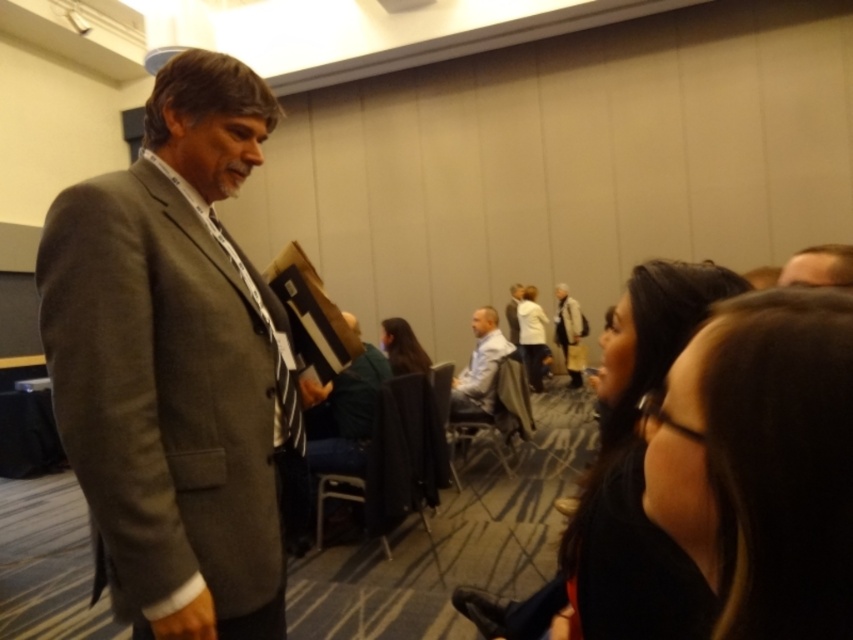
Question: Is gray wool suit at center positioned at the back of black fabric chair at center?

Choices:
 (A) yes
 (B) no

Answer: (B)

Question: Does black fabric chair at center have a lesser width compared to metallic gray chair at center?

Choices:
 (A) no
 (B) yes

Answer: (A)

Question: Which point is closer to the camera?

Choices:
 (A) light blue shirt at center
 (B) matte black tie at center
 (C) light brown hair at upper right

Answer: (C)

Question: Does gray wool suit at center lie behind light gray suit at center?

Choices:
 (A) yes
 (B) no

Answer: (B)

Question: Which of the following is the closest to the observer?

Choices:
 (A) (140, 282)
 (B) (569, 308)

Answer: (A)

Question: Which point is farther to the camera?

Choices:
 (A) metallic gray chair at center
 (B) black fabric chair at center
 (C) light gray fabric jacket at center

Answer: (C)